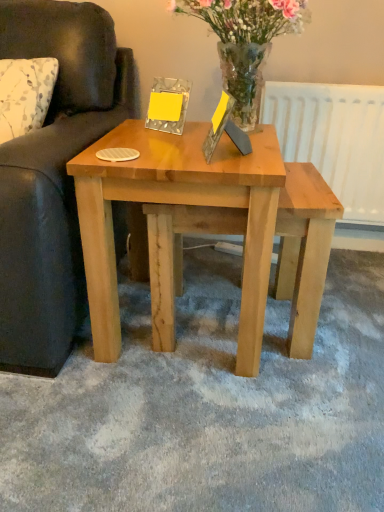
Question: Is white matte radiator at upper right oriented towards wooden picture frame at center?

Choices:
 (A) no
 (B) yes

Answer: (B)

Question: Could wooden picture frame at center be considered to be inside white matte radiator at upper right?

Choices:
 (A) yes
 (B) no

Answer: (B)

Question: Does white matte radiator at upper right have a larger size compared to wooden picture frame at center?

Choices:
 (A) no
 (B) yes

Answer: (B)

Question: Does white matte radiator at upper right touch wooden picture frame at center?

Choices:
 (A) yes
 (B) no

Answer: (B)

Question: Is white matte radiator at upper right turned away from wooden picture frame at center?

Choices:
 (A) no
 (B) yes

Answer: (A)

Question: Is translucent glass vase at upper center in front of or behind wooden picture frame at center in the image?

Choices:
 (A) front
 (B) behind

Answer: (B)

Question: From the image's perspective, relative to wooden picture frame at center, is translucent glass vase at upper center above or below?

Choices:
 (A) above
 (B) below

Answer: (A)

Question: Considering the positions of translucent glass vase at upper center and wooden picture frame at center in the image, is translucent glass vase at upper center taller or shorter than wooden picture frame at center?

Choices:
 (A) short
 (B) tall

Answer: (B)

Question: Is translucent glass vase at upper center wider or thinner than wooden picture frame at center?

Choices:
 (A) wide
 (B) thin

Answer: (A)

Question: Looking at the image, does natural wood coffee table at center seem bigger or smaller compared to white matte radiator at upper right?

Choices:
 (A) big
 (B) small

Answer: (A)

Question: Is point (263, 228) closer or farther from the camera than point (380, 202)?

Choices:
 (A) closer
 (B) farther

Answer: (A)

Question: In the image, is natural wood coffee table at center positioned in front of or behind white matte radiator at upper right?

Choices:
 (A) front
 (B) behind

Answer: (A)

Question: From the image's perspective, is natural wood coffee table at center positioned above or below white matte radiator at upper right?

Choices:
 (A) above
 (B) below

Answer: (B)

Question: From a real-world perspective, relative to white matte radiator at upper right, is wooden picture frame at center vertically above or below?

Choices:
 (A) below
 (B) above

Answer: (B)

Question: In terms of size, does wooden picture frame at center appear bigger or smaller than white matte radiator at upper right?

Choices:
 (A) big
 (B) small

Answer: (B)